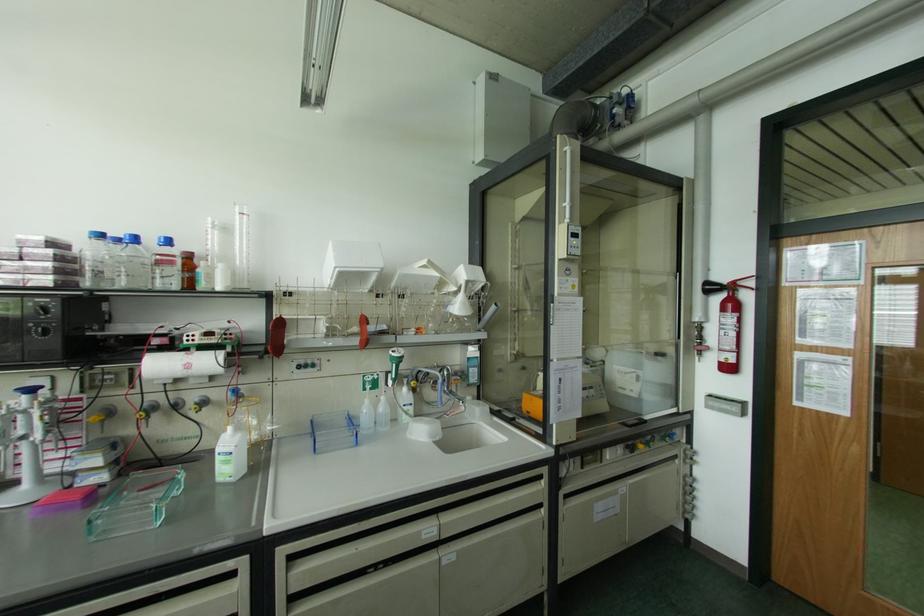
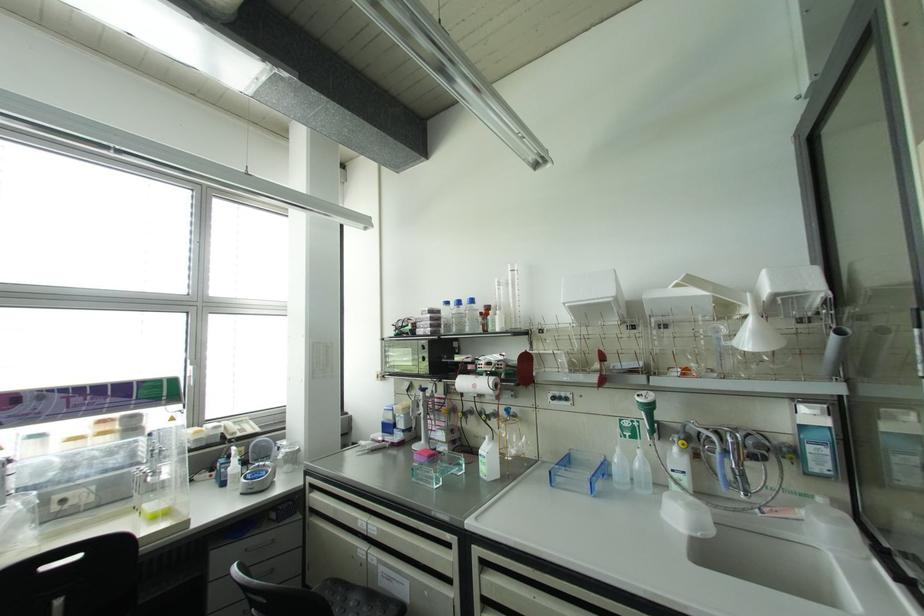
Where in the second image is the point corresponding to the point at 188,366 from the first image?

(473, 386)